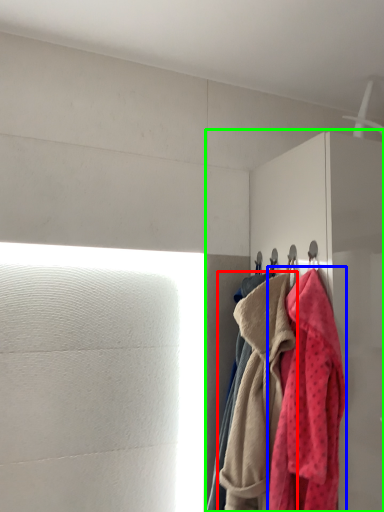
Question: Which object is the farthest from towel (highlighted by a red box)? Choose among these: towel (highlighted by a blue box) or dresser (highlighted by a green box).

Choices:
 (A) towel
 (B) dresser

Answer: (B)